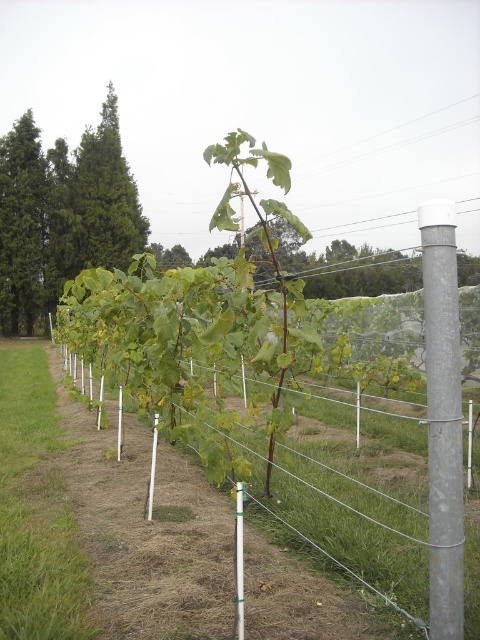
You are a vineyard worker checking the trellis system. You need to locate the galvanized metal pole at right and the silver metallic pole at center. From the perspective of someone standing at the left edge of the vineyard, which pole is closer to the left side?

The silver metallic pole at center is closer to the left side because the galvanized metal pole at right is to the right of it.

You are a vineyard worker standing at the center of the vineyard rows. You need to locate the galvanized metal pole at right. According to the coordinates provided, where would you find it?

The galvanized metal pole at right is located at point (443, 419).